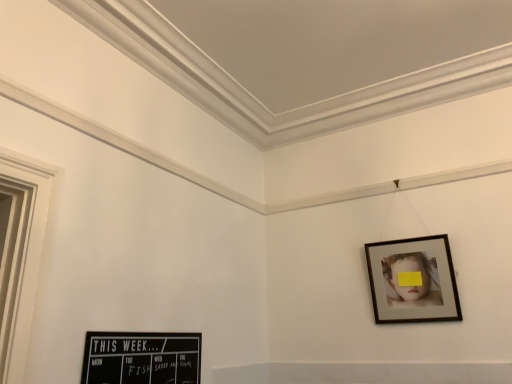
Question: Can you confirm if black chalkboard at lower left, the 2th picture frame in the right-to-left sequence, is wider than wooden frame at upper right, which is the second picture frame in left-to-right order?

Choices:
 (A) yes
 (B) no

Answer: (B)

Question: Is the depth of black chalkboard at lower left, the 2th picture frame in the right-to-left sequence, greater than that of wooden frame at upper right, which appears as the 2th picture frame when viewed from the front?

Choices:
 (A) yes
 (B) no

Answer: (B)

Question: Is black chalkboard at lower left, which is the second picture frame from back to front, located outside wooden frame at upper right, the 1th picture frame from the right?

Choices:
 (A) no
 (B) yes

Answer: (B)

Question: From a real-world perspective, is black chalkboard at lower left, which is the second picture frame from back to front, on top of wooden frame at upper right, which ranks as the first picture frame in back-to-front order?

Choices:
 (A) no
 (B) yes

Answer: (A)

Question: From the image's perspective, does black chalkboard at lower left, the first picture frame from the front, appear lower than wooden frame at upper right, which appears as the 2th picture frame when viewed from the front?

Choices:
 (A) no
 (B) yes

Answer: (B)

Question: Does black chalkboard at lower left, which is the second picture frame from back to front, have a lesser height compared to wooden frame at upper right, which is the second picture frame in left-to-right order?

Choices:
 (A) yes
 (B) no

Answer: (A)

Question: Can you confirm if wooden frame at upper right, which is the second picture frame in left-to-right order, is shorter than black chalkboard at lower left, acting as the 1th picture frame starting from the left?

Choices:
 (A) yes
 (B) no

Answer: (B)

Question: Is wooden frame at upper right, which ranks as the first picture frame in back-to-front order, not near black chalkboard at lower left, the 2th picture frame in the right-to-left sequence?

Choices:
 (A) yes
 (B) no

Answer: (A)

Question: From a real-world perspective, is wooden frame at upper right, which is the second picture frame in left-to-right order, on top of black chalkboard at lower left, which is the second picture frame from back to front?

Choices:
 (A) yes
 (B) no

Answer: (A)

Question: Could you tell me if wooden frame at upper right, which appears as the 2th picture frame when viewed from the front, is turned towards black chalkboard at lower left, the 2th picture frame in the right-to-left sequence?

Choices:
 (A) no
 (B) yes

Answer: (A)

Question: Is wooden frame at upper right, which is the second picture frame in left-to-right order, positioned behind black chalkboard at lower left, the first picture frame from the front?

Choices:
 (A) yes
 (B) no

Answer: (A)

Question: Is wooden frame at upper right, which is the second picture frame in left-to-right order, beside black chalkboard at lower left, acting as the 1th picture frame starting from the left?

Choices:
 (A) no
 (B) yes

Answer: (A)

Question: Is black chalkboard at lower left, acting as the 1th picture frame starting from the left, inside the boundaries of wooden frame at upper right, which appears as the 2th picture frame when viewed from the front, or outside?

Choices:
 (A) inside
 (B) outside

Answer: (B)